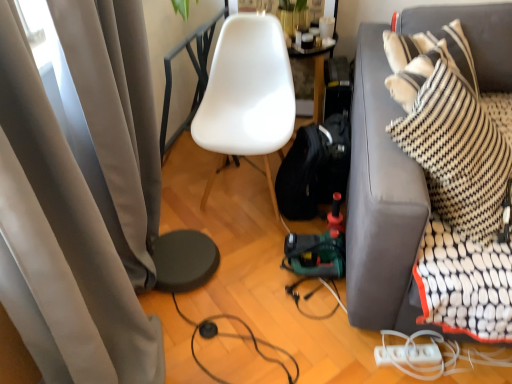
Find the location of a particular element. free space that is in between white plastic extension cord at lower right and black rubber cable at lower center, marked as the 1th cable in a left-to-right arrangement is located at coordinates (333, 358).